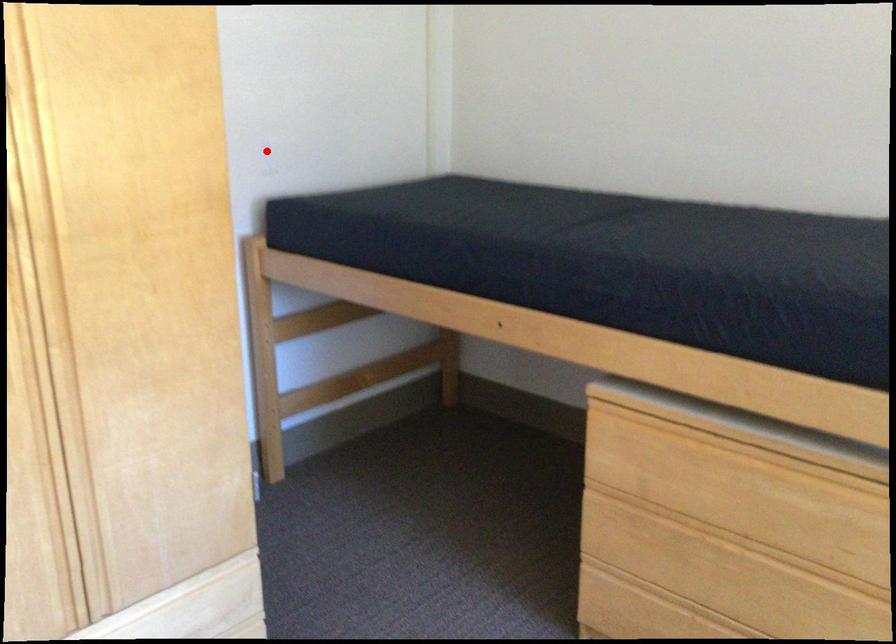
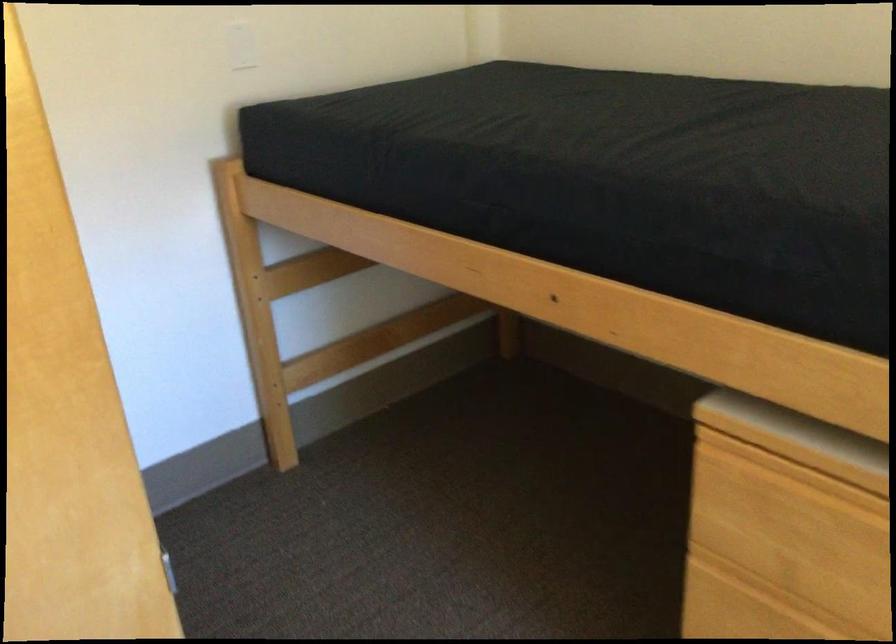
Question: I am providing you with two images of the same scene from different viewpoints. In image1, a red point is highlighted. Considering the same 3D point in image2, which of the following is correct?

Choices:
 (A) It is closer
 (B) It is farther

Answer: (A)